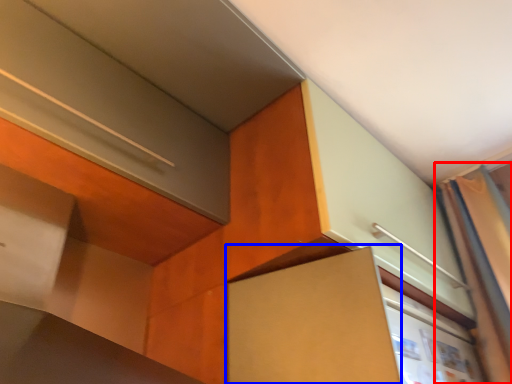
Question: Which object appears farthest to the camera in this image, curtain (highlighted by a red box) or cabinetry (highlighted by a blue box)?

Choices:
 (A) curtain
 (B) cabinetry

Answer: (A)